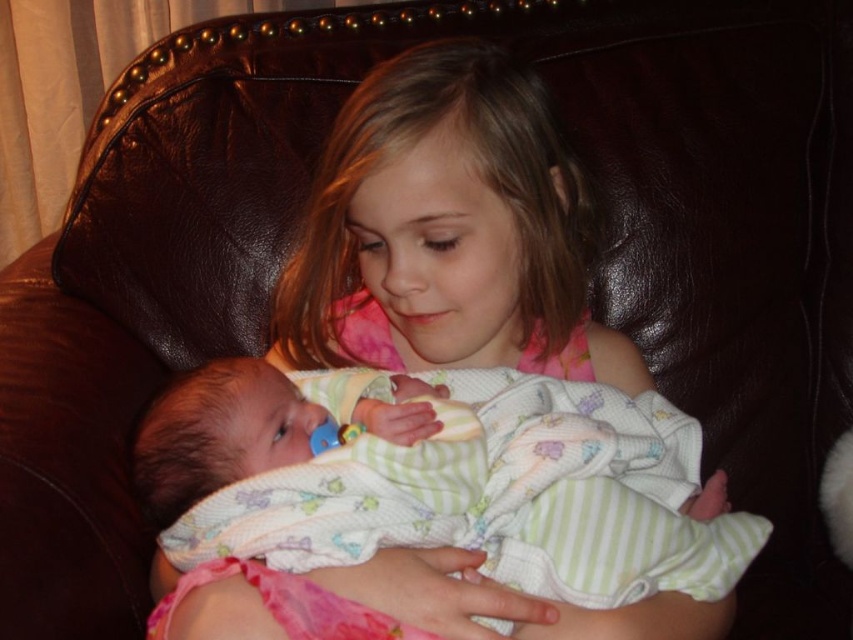
Question: In this image, where is pink fabric dress at center located relative to soft green fabric baby at center?

Choices:
 (A) left
 (B) right

Answer: (A)

Question: Can you confirm if pink fabric dress at center is bigger than soft green fabric baby at center?

Choices:
 (A) yes
 (B) no

Answer: (A)

Question: Is pink fabric dress at center further to the viewer compared to soft green fabric baby at center?

Choices:
 (A) yes
 (B) no

Answer: (B)